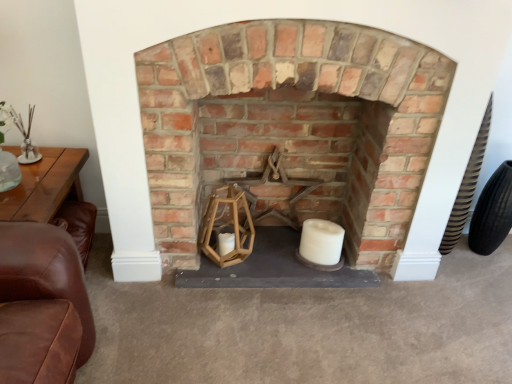
Locate an element on the screen. The image size is (512, 384). vacant point to the left of black rubber tire at right is located at coordinates (454, 261).